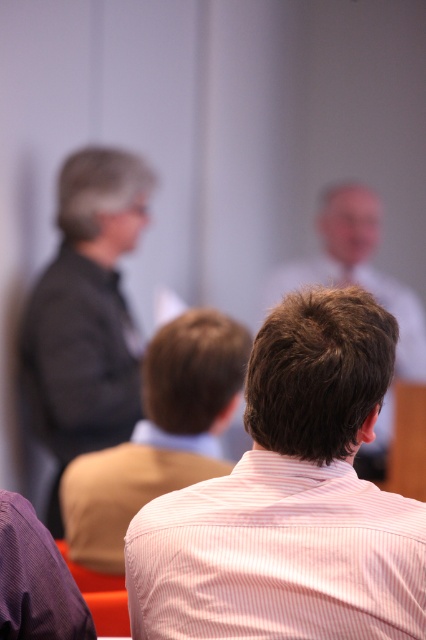
Question: Is dark gray suit at left thinner than light brown hair at center?

Choices:
 (A) no
 (B) yes

Answer: (B)

Question: Is dark gray suit at left below light brown shirt at center?

Choices:
 (A) yes
 (B) no

Answer: (B)

Question: Is pink striped shirt at center bigger than dark gray suit at left?

Choices:
 (A) yes
 (B) no

Answer: (B)

Question: Among these objects, which one is nearest to the camera?

Choices:
 (A) light brown hair at center
 (B) pink striped shirt at center
 (C) dark gray suit at left
 (D) light brown shirt at center

Answer: (B)

Question: Which is farther from the dark gray suit at left?

Choices:
 (A) pink striped shirt at center
 (B) light brown hair at center
 (C) light brown shirt at center

Answer: (A)

Question: Considering the real-world distances, which object is farthest from the light brown hair at center?

Choices:
 (A) dark gray suit at left
 (B) light brown shirt at center
 (C) pink striped shirt at center

Answer: (C)